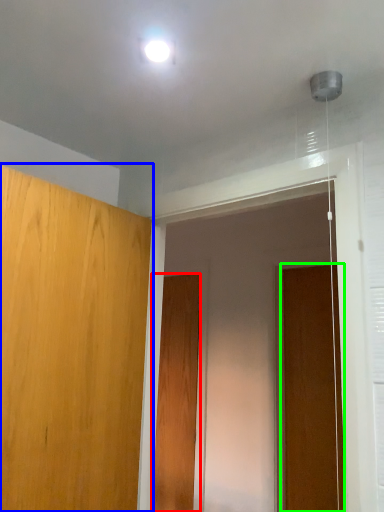
Question: Which object is the farthest from door (highlighted by a red box)? Choose among these: door (highlighted by a blue box) or door (highlighted by a green box).

Choices:
 (A) door
 (B) door

Answer: (A)